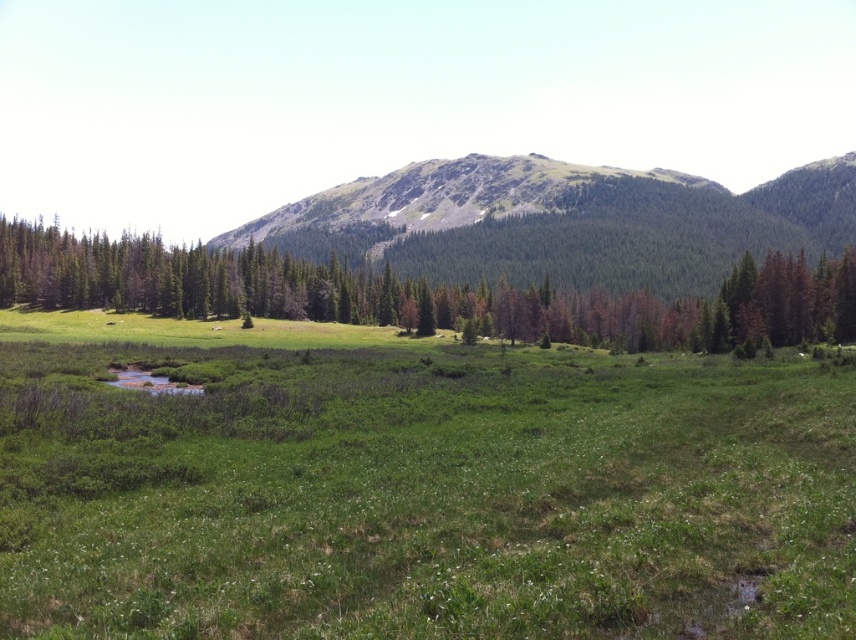
You are planning to take a photo of the rocky mountain at center and the green leafy tree at center. Which object should you focus on first if you want to capture both in a single frame without moving the camera?

The rocky mountain at center is larger in size than the green leafy tree at center, so you should focus on the rocky mountain at center first to ensure it fits properly in the frame before adjusting for the smaller tree.

You are a hiker planning to take a photo of the rocky mountain at center. You want to ensure the mountain is the main focus of your photo. Based on its position in the scene, where should you position yourself to capture the mountain effectively?

The rocky mountain at center is located at point (x=563, y=221), so positioning yourself directly in front of it would ensure it becomes the main focus of the photo.

You are hiking and want to reach the rocky mountain at center. You see a green leafy tree at center blocking your path. Which direction should you go around it to reach the mountain?

Since the rocky mountain at center is further away than the green leafy tree at center, you should go around the green leafy tree at center either to the left or right to reach the rocky mountain at center.